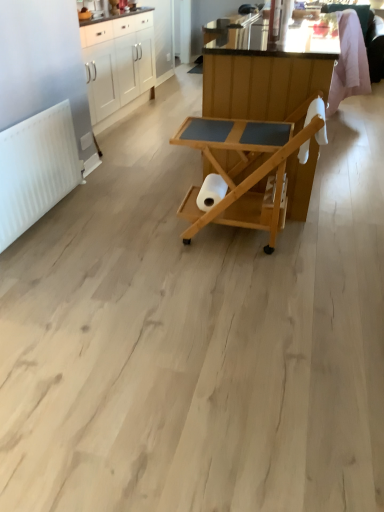
The height and width of the screenshot is (512, 384). In order to click on free space above white matte toilet paper at center (from a real-world perspective) in this screenshot , I will do `click(217, 179)`.